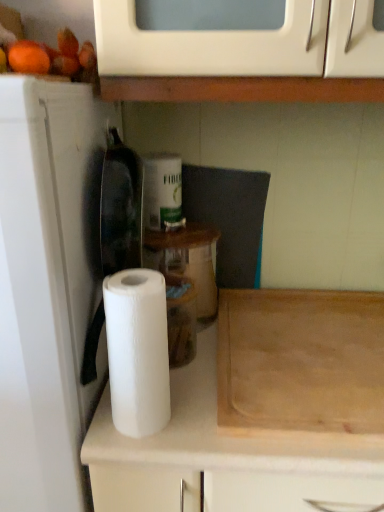
What is the approximate height of white paper towel at left?

white paper towel at left is 1.26 meters tall.

Measure the distance between white paper towel at left and camera.

The depth of white paper towel at left is 20.33 inches.

I want to click on wooden cutting board at lower right, so click(x=301, y=360).

What is the approximate height of white matte paper towel roll at center?

The height of white matte paper towel roll at center is 33.45 inches.

Locate an element on the screen. This screenshot has height=512, width=384. white matte paper towel at center is located at coordinates (137, 351).

The image size is (384, 512). Identify the location of cutting board on the right of white paper towel at left. (301, 360).

Looking at this image, are wooden cutting board at lower right and white paper towel at left making contact?

No, wooden cutting board at lower right is not beside white paper towel at left.

From the image's perspective, which object appears higher, wooden cutting board at lower right or white paper towel at left?

wooden cutting board at lower right, from the image's perspective.

Considering the sizes of wooden cutting board at lower right and white paper towel at left in the image, is wooden cutting board at lower right taller or shorter than white paper towel at left?

Considering their sizes, wooden cutting board at lower right has less height than white paper towel at left.

Consider the image. Considering the sizes of objects wooden cutting board at lower right and white matte paper towel roll at center in the image provided, who is wider, wooden cutting board at lower right or white matte paper towel roll at center?

white matte paper towel roll at center.

Does wooden cutting board at lower right have a smaller size compared to white matte paper towel roll at center?

Yes, wooden cutting board at lower right is smaller than white matte paper towel roll at center.

Are wooden cutting board at lower right and white matte paper towel roll at center beside each other?

Yes, wooden cutting board at lower right is touching white matte paper towel roll at center.

Considering the relative sizes of white matte paper towel roll at center and white matte paper towel at center in the image provided, is white matte paper towel roll at center wider than white matte paper towel at center?

Indeed, white matte paper towel roll at center has a greater width compared to white matte paper towel at center.

Is point (288, 451) positioned in front of point (127, 395)?

No, (288, 451) is further to viewer.

From a real-world perspective, is white matte paper towel roll at center on white matte paper towel at center?

No, from a real-world perspective, white matte paper towel roll at center is not over white matte paper towel at center

Can you tell me how much white matte paper towel roll at center and white matte paper towel at center differ in facing direction?

2.12 degrees.

Does white matte paper towel roll at center have a lesser width compared to wooden cutting board at lower right?

No.

Is wooden cutting board at lower right completely or partially inside white matte paper towel roll at center?

Yes.

Can you confirm if white matte paper towel roll at center is positioned to the left of wooden cutting board at lower right?

Yes.

Identify the location of cutting board behind the white matte paper towel roll at center. (301, 360).

Find the location of a particular element. The width and height of the screenshot is (384, 512). paper towel behind the white paper towel at left is located at coordinates (137, 351).

Who is more distant, white matte paper towel at center or white paper towel at left?

white matte paper towel at center is further from the camera.

Would you say white matte paper towel at center is outside white paper towel at left?

white matte paper towel at center lies outside white paper towel at left's area.

Would you say white matte paper towel roll at center is to the left or to the right of white paper towel at left in the picture?

From the image, it's evident that white matte paper towel roll at center is to the right of white paper towel at left.

Considering the relative sizes of white matte paper towel roll at center and white paper towel at left in the image provided, is white matte paper towel roll at center bigger than white paper towel at left?

Yes.

Locate an element on the screen. cabinetry that is on the right side of white paper towel at left is located at coordinates (260, 405).

Is white matte paper towel at center at the back of white paper towel at left?

No, white paper towel at left's orientation is not away from white matte paper towel at center.

Which is less distant, (38, 494) or (164, 305)?

Point (38, 494) is positioned farther from the camera compared to point (164, 305).

Which of these two, white paper towel at left or white matte paper towel at center, stands shorter?

white matte paper towel at center is shorter.

You are a GUI agent. You are given a task and a screenshot of the screen. Output one action in this format:
    pyautogui.click(x=<x>, y=<y>)
    Task: Click on the appliance below the wooden cutting board at lower right (from the image's perspective)
    The height and width of the screenshot is (512, 384).
    Given the screenshot: What is the action you would take?
    pyautogui.click(x=48, y=287)

Where is `cabinetry below the wooden cutting board at lower right (from a real-world perspective)`? This screenshot has width=384, height=512. cabinetry below the wooden cutting board at lower right (from a real-world perspective) is located at coordinates pos(260,405).

Looking at the image, which one is located closer to white matte paper towel at center, wooden cutting board at lower right or white paper towel at left?

white paper towel at left lies closer to white matte paper towel at center than the other object.

When comparing their distances from white matte paper towel roll at center, does wooden cutting board at lower right or white matte paper towel at center seem closer?

Based on the image, wooden cutting board at lower right appears to be nearer to white matte paper towel roll at center.

Looking at the image, which one is located closer to wooden cutting board at lower right, white matte paper towel at center or white paper towel at left?

The object closer to wooden cutting board at lower right is white matte paper towel at center.

When comparing their distances from wooden cutting board at lower right, does white paper towel at left or white matte paper towel at center seem further?

white paper towel at left is further to wooden cutting board at lower right.

When comparing their distances from white paper towel at left, does white matte paper towel at center or wooden cutting board at lower right seem closer?

Based on the image, white matte paper towel at center appears to be nearer to white paper towel at left.

Which object lies further to the anchor point white matte paper towel roll at center, white paper towel at left or wooden cutting board at lower right?

white paper towel at left is further to white matte paper towel roll at center.

Considering their positions, is white matte paper towel roll at center positioned further to white matte paper towel at center than white paper towel at left?

white matte paper towel roll at center is positioned further to the anchor white matte paper towel at center.

Considering their positions, is white matte paper towel roll at center positioned further to wooden cutting board at lower right than white matte paper towel at center?

Among the two, white matte paper towel at center is located further to wooden cutting board at lower right.

The width and height of the screenshot is (384, 512). Find the location of `paper towel located between white paper towel at left and white matte paper towel roll at center in the left-right direction`. paper towel located between white paper towel at left and white matte paper towel roll at center in the left-right direction is located at coordinates (137, 351).

Find the location of a particular element. Image resolution: width=384 pixels, height=512 pixels. cabinetry between white paper towel at left and wooden cutting board at lower right is located at coordinates (260, 405).

What are the coordinates of `cutting board between white matte paper towel at center and white matte paper towel roll at center from top to bottom` in the screenshot? It's located at (301, 360).

This screenshot has width=384, height=512. I want to click on paper towel between white paper towel at left and wooden cutting board at lower right in the horizontal direction, so click(137, 351).